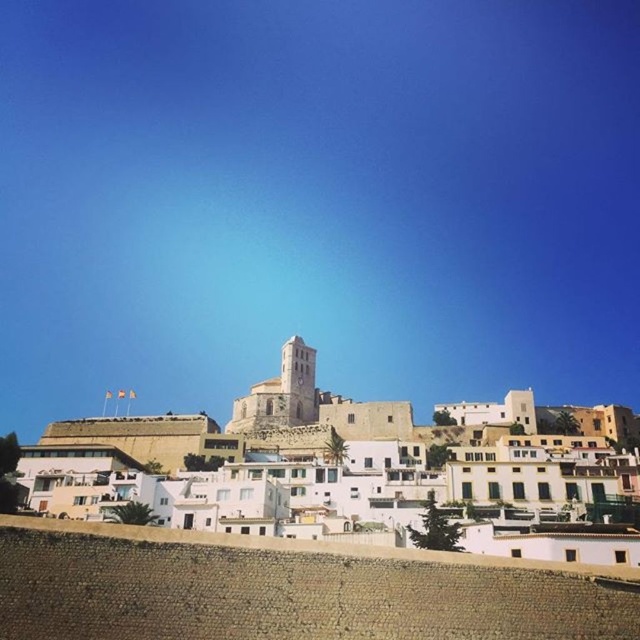
You are an architect analyzing the layout of the Mediterranean town in the image. You notice the white stucco buildings at center and the white stone tower at center. Which of these two structures has a greater width?

The white stucco buildings at center have a greater width than the white stone tower at center, as stated in the description.

You are an architect visiting the Mediterranean town and want to know which structure is taller between the white stucco buildings at center and the white stone tower at center. Based on the scene, which one is taller?

The white stone tower at center is taller than the white stucco buildings at center.